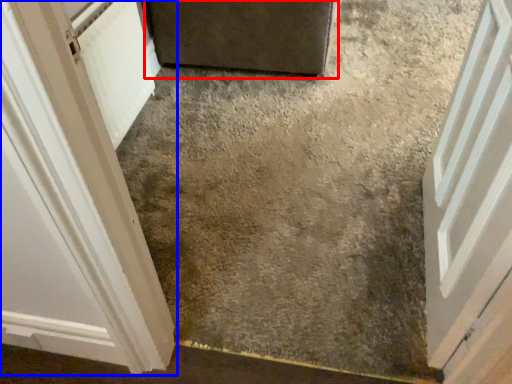
Question: Which of the following is the closest to the observer, door (highlighted by a red box) or door (highlighted by a blue box)?

Choices:
 (A) door
 (B) door

Answer: (B)